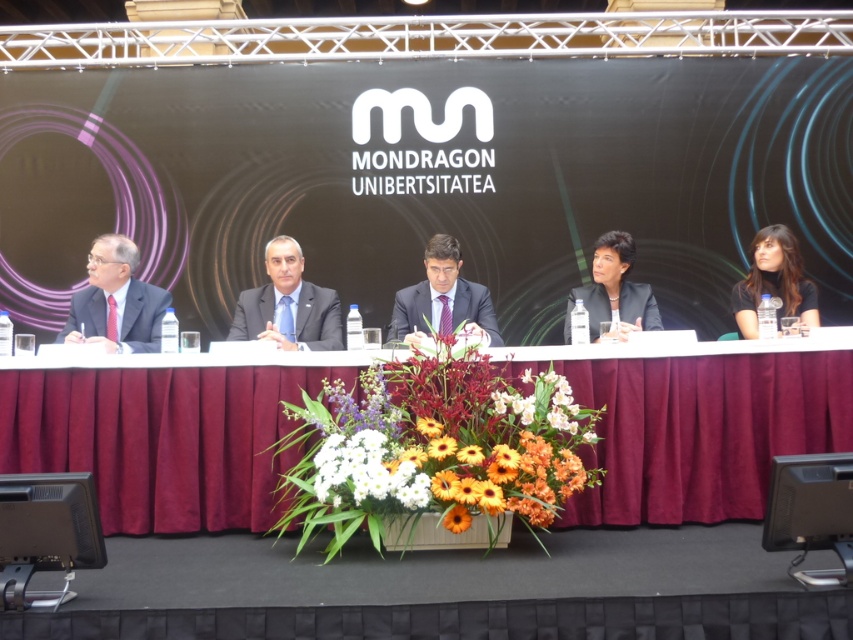
You are organizing a photo shoot and need to ensure that the floral bouquet at center and the dark brown hair at upper right are both visible in the frame. Based on their sizes, which object should you prioritize positioning first to ensure it fits within the camera frame?

The floral bouquet at center has a greater width than the dark brown hair at upper right, so you should prioritize positioning the floral bouquet at center first to ensure it fits within the camera frame.

You are organizing a photo shoot for a fashion magazine and need to place two suits on a mannequin stand. The matte black suit at left and the dark blue fabric suit at center are available. Based on the image, which suit would require a wider stand to accommodate its width?

The matte black suit at left requires a wider stand because its width is larger than the dark blue fabric suit at center.

Looking at this image, you are standing in front of the long table at the formal event. There are two points marked on the table surface. The first point is at coordinate location point (x=751, y=253) and the second is at point (x=241, y=304). Which point is closer to you?

Point (x=241, y=304) is closer to you because it is nearer to the viewer compared to point (x=751, y=253), which is further away.